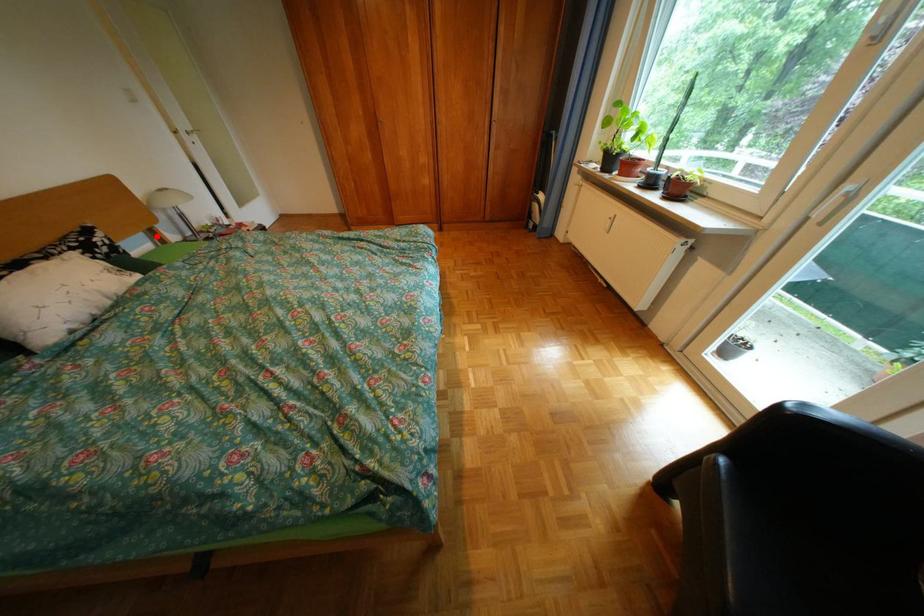
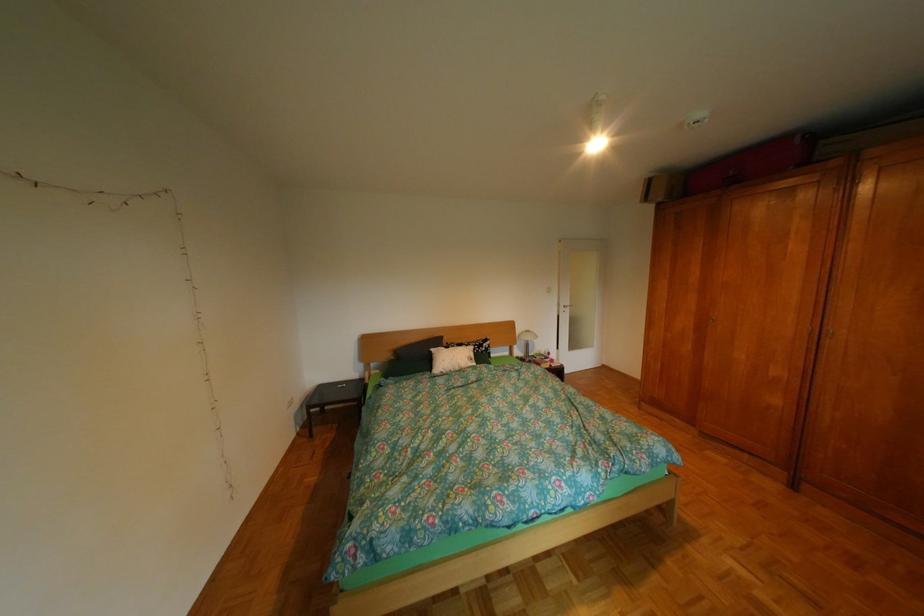
Question: I am providing you with two images of the same scene from different viewpoints. A red point is shown in image1. For the corresponding object point in image2, is it positioned nearer or farther from the camera?

Choices:
 (A) Nearer
 (B) Farther

Answer: (B)